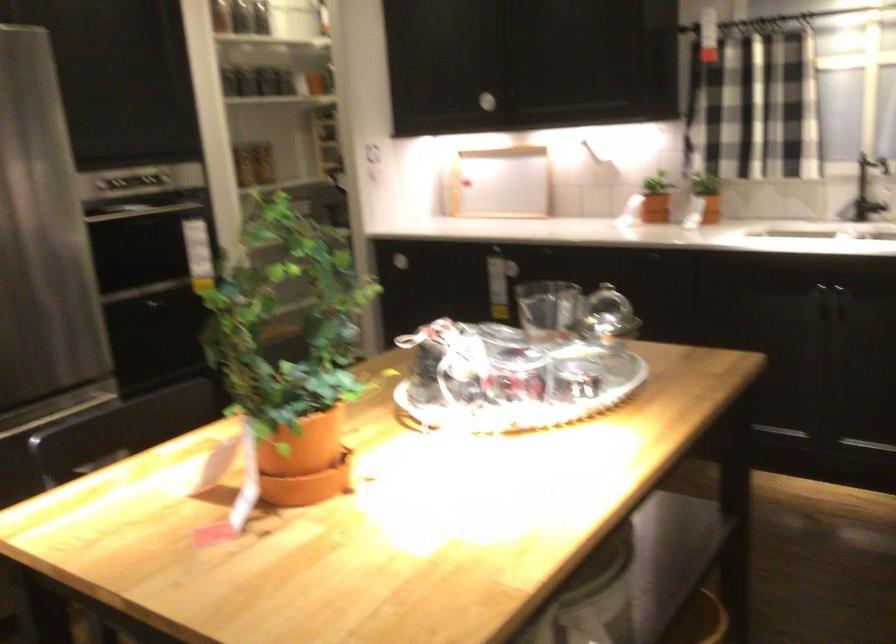
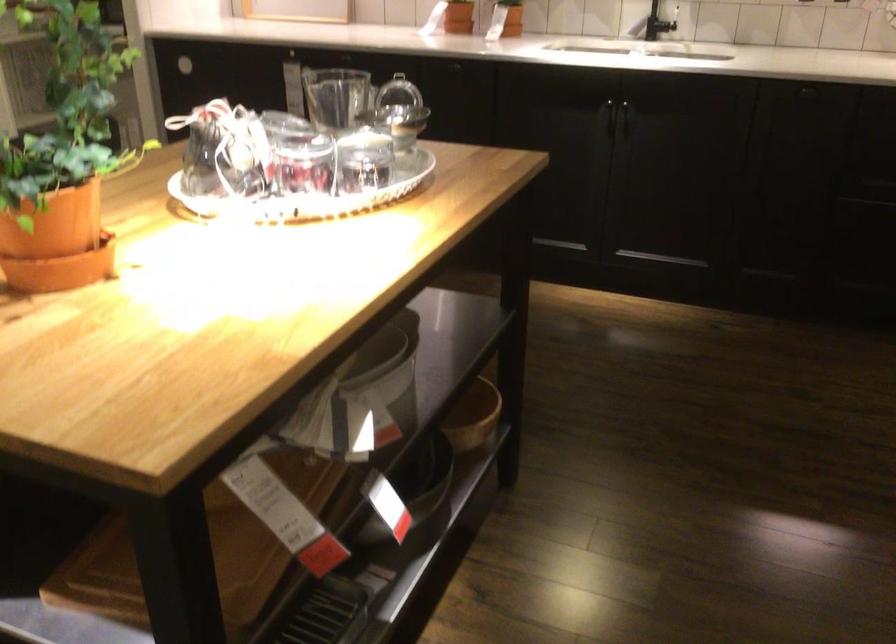
The point at [814,290] is marked in the first image. Where is the corresponding point in the second image?

(599, 107)